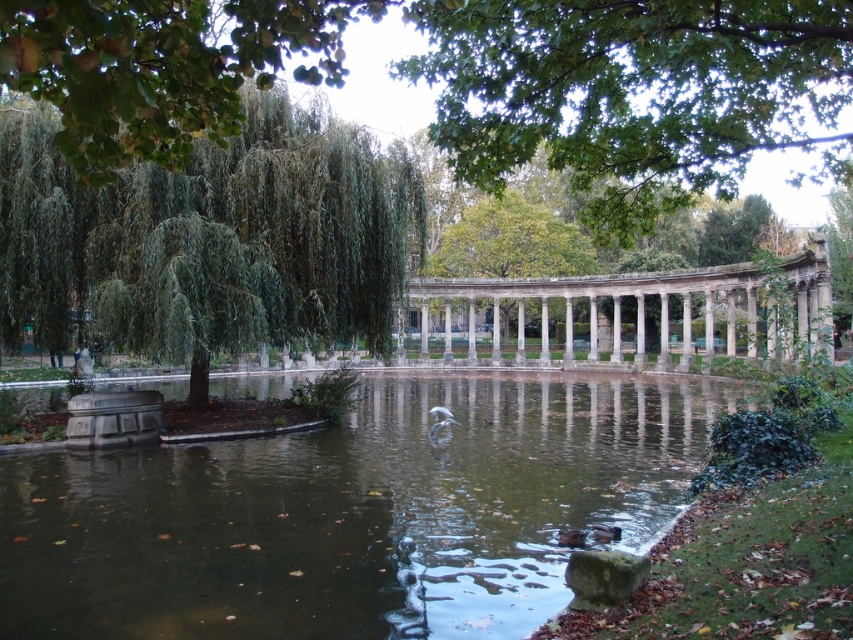
You are standing in the park and want to reach the point marked at coordinates (492,102). If your walking speed is 1.5 meters per second, how many seconds will it take you to reach that point?

The distance to the point is 35.77 meters. At a speed of 1.5 meters per second, it will take approximately 23.85 seconds to reach the point.

You are standing in the park and see two points marked in the image. The first point is at coordinates point (x=436, y=100) and the second is at point (x=546, y=209). Which point is closer to you?

Point (x=436, y=100) is in front of point (x=546, y=209), so it is closer to you.